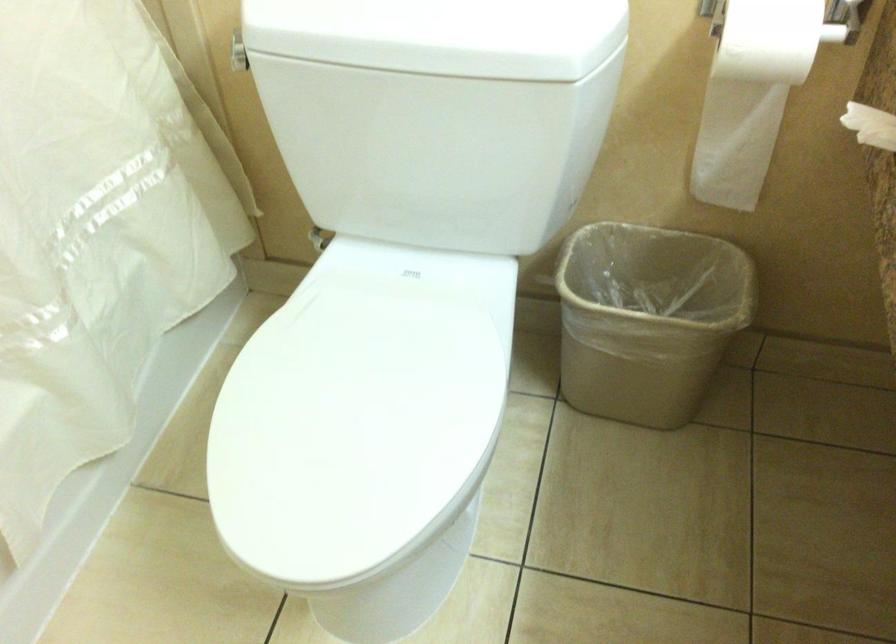
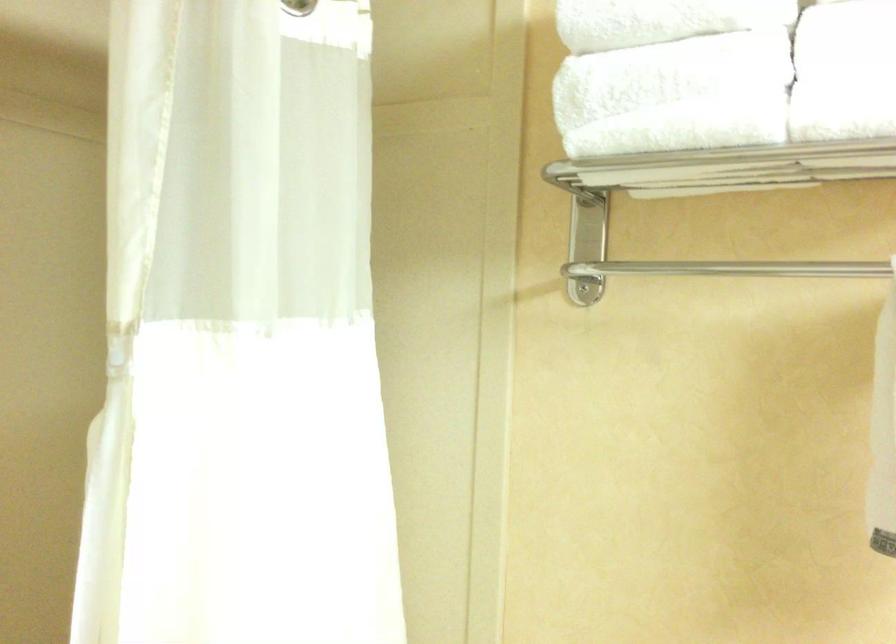
The first image is from the beginning of the video and the second image is from the end. How did the camera likely rotate when shooting the video?

The rotation direction of the camera is left-up.